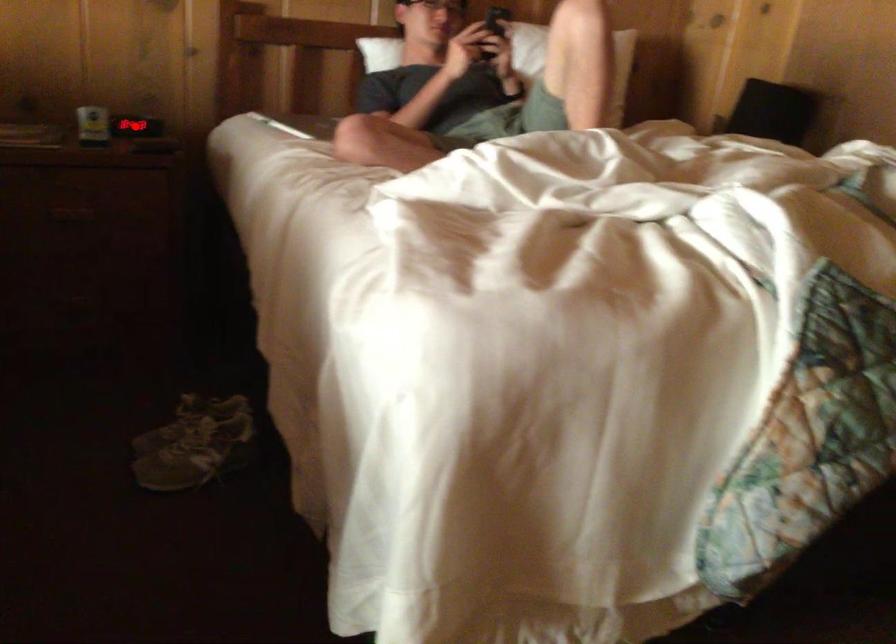
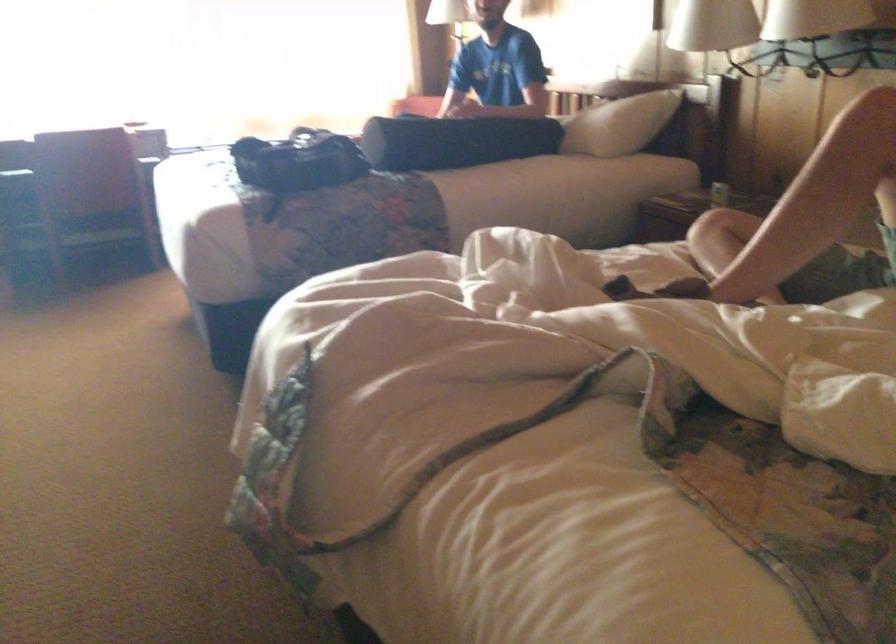
Question: I am providing you with two images of the same scene from different viewpoints. A red point is marked on the first image. Can you still see the location of the red point in image 2?

Choices:
 (A) Yes
 (B) No

Answer: (B)